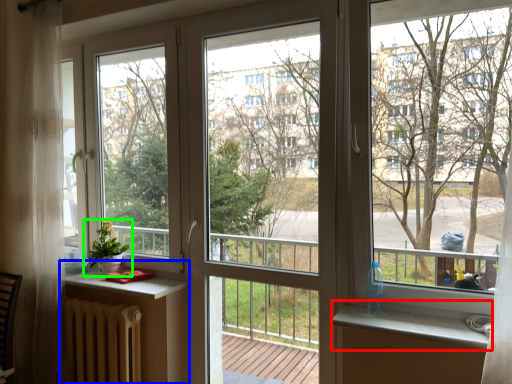
Question: Which object is the closest to the window sill (highlighted by a red box)? Choose among these: table (highlighted by a blue box) or houseplant (highlighted by a green box).

Choices:
 (A) table
 (B) houseplant

Answer: (A)